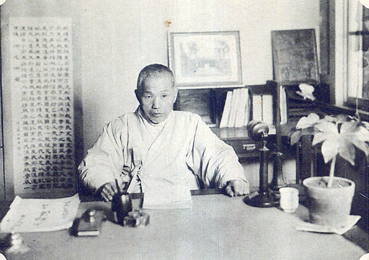
Identify the location of pot with plant in it. (328, 202).